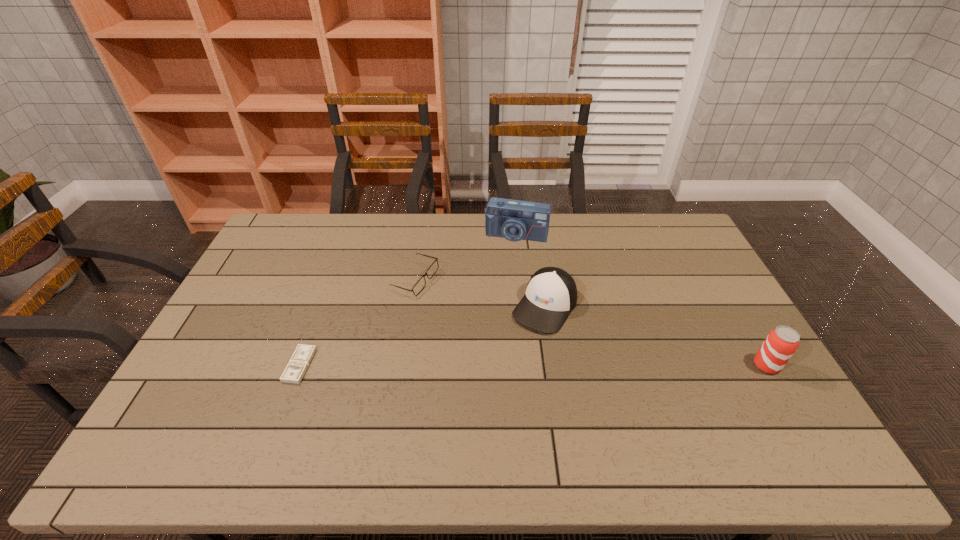
Where is `vacant space on the desktop that is between the money and the rightmost object and is positioned with the lenses facing outward on the fourth object from right to left`? The image size is (960, 540). vacant space on the desktop that is between the money and the rightmost object and is positioned with the lenses facing outward on the fourth object from right to left is located at coordinates (489, 365).

The height and width of the screenshot is (540, 960). I want to click on vacant space on the desktop that is between the leftmost object and the rightmost object and is positioned on the lens of the camera, so click(479, 365).

This screenshot has height=540, width=960. Identify the location of free space on the desktop that is between the leftmost object and the beer can and is positioned on the front panel of the cap. (505, 365).